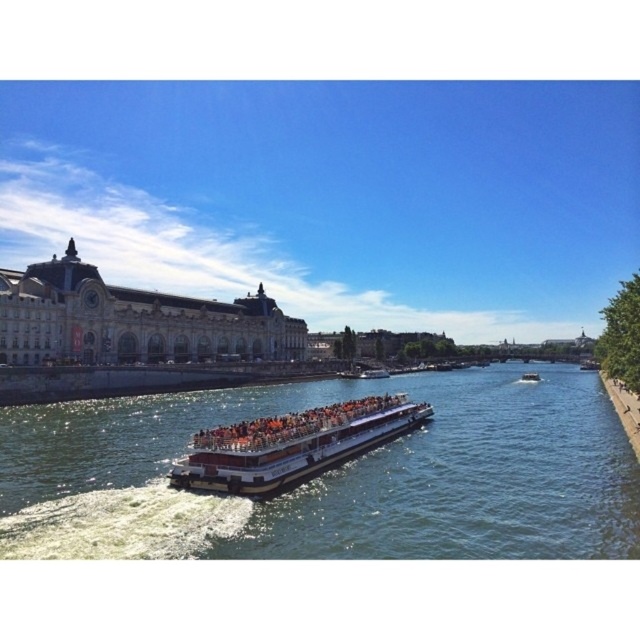
You are standing on the riverbank and see the metallic silver boat at center. If you want to throw a small pebble to reach the boat, considering the distance, would it be possible for you to do so?

The metallic silver boat at center is 210.09 feet away from the viewer. Since the average person can throw a pebble about 100 feet, it is unlikely you can reach the boat with a single throw.